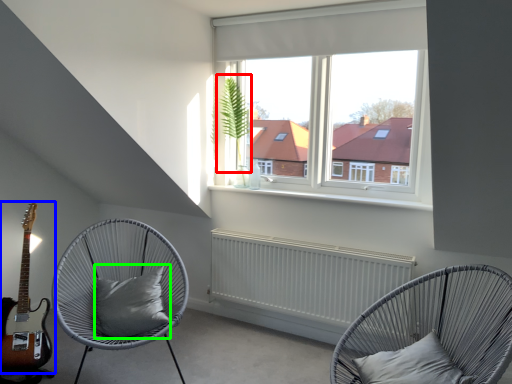
Question: Which object is the closest to the plant (highlighted by a red box)? Choose among these: guitar (highlighted by a blue box) or pillow (highlighted by a green box).

Choices:
 (A) guitar
 (B) pillow

Answer: (B)